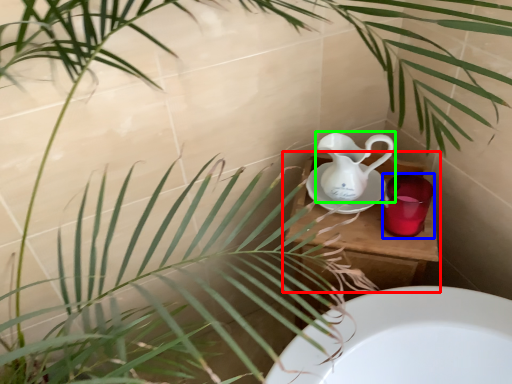
Question: Considering the real-world distances, which object is farthest from table (highlighted by a red box)? mug (highlighted by a blue box) or jug (highlighted by a green box)?

Choices:
 (A) mug
 (B) jug

Answer: (B)